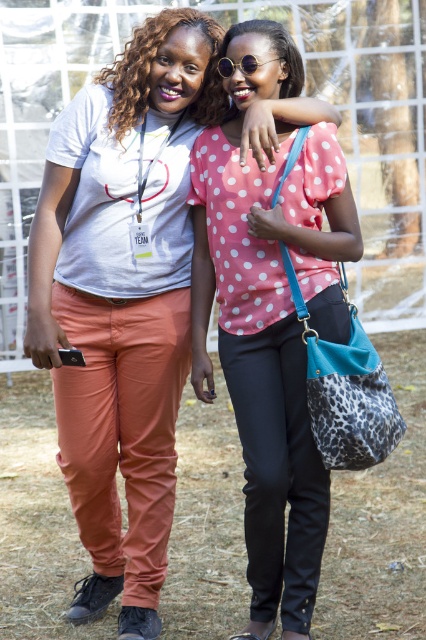
Question: Which point appears closest to the camera in this image?

Choices:
 (A) (256, 474)
 (B) (250, 72)

Answer: (A)

Question: Is pink dotted blouse at center bigger than sunglasses at center?

Choices:
 (A) yes
 (B) no

Answer: (A)

Question: Does pink dotted blouse at center have a lesser width compared to sunglasses at center?

Choices:
 (A) yes
 (B) no

Answer: (B)

Question: Which point is closer to the camera?

Choices:
 (A) (224, 124)
 (B) (270, 60)

Answer: (B)

Question: Which object is closer to the camera taking this photo?

Choices:
 (A) sunglasses at center
 (B) pink dotted blouse at center

Answer: (B)

Question: Is pink dotted blouse at center to the right of sunglasses at center from the viewer's perspective?

Choices:
 (A) no
 (B) yes

Answer: (B)